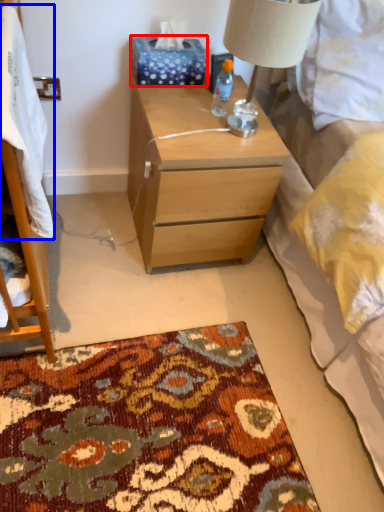
Question: Which point is closer to the camera, tissue paper (highlighted by a red box) or blanket (highlighted by a blue box)?

Choices:
 (A) tissue paper
 (B) blanket

Answer: (B)